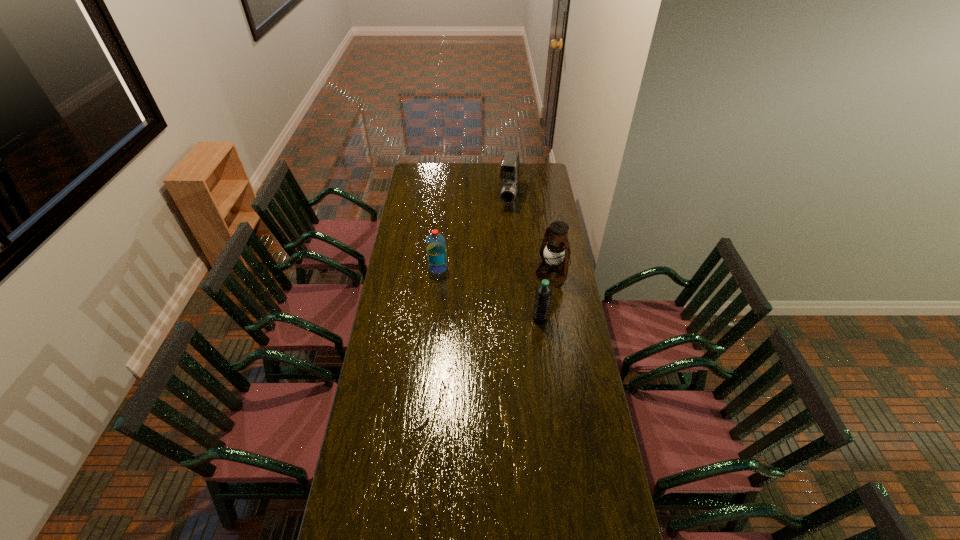
In the image, there is a desktop. In order to click on vacant space at the left edge in this screenshot , I will do `click(399, 276)`.

I want to click on free space at the right edge of the desktop, so click(x=558, y=293).

This screenshot has width=960, height=540. I want to click on free space at the far left corner of the desktop, so click(x=419, y=164).

Locate an element on the screen. Image resolution: width=960 pixels, height=540 pixels. vacant space at the far right corner of the desktop is located at coordinates (530, 170).

Image resolution: width=960 pixels, height=540 pixels. In the image, there is a desktop. Find the location of `vacant space at the near right corner`. vacant space at the near right corner is located at coordinates (607, 522).

The image size is (960, 540). What are the coordinates of `vacant area between the farthest object and the left water bottle` in the screenshot? It's located at (473, 233).

Image resolution: width=960 pixels, height=540 pixels. I want to click on free space between the farther water bottle and the nearer water bottle, so click(489, 293).

Locate an element on the screen. The image size is (960, 540). free area in between the farther water bottle and the third object from right to left is located at coordinates (473, 233).

Where is `vacant space in between the farthest object and the leftmost object`? This screenshot has height=540, width=960. vacant space in between the farthest object and the leftmost object is located at coordinates (473, 233).

Where is `vacant point located between the tallest object and the second object from left to right`? The width and height of the screenshot is (960, 540). vacant point located between the tallest object and the second object from left to right is located at coordinates (530, 235).